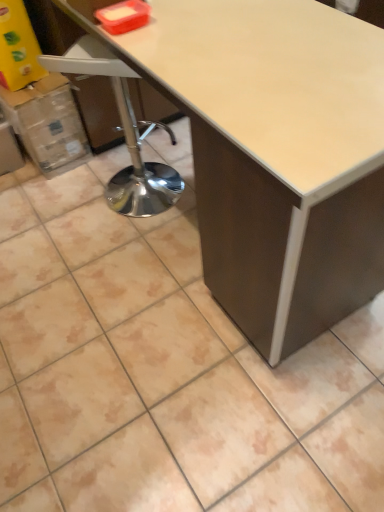
Question: Is matte white table at center at the left side of cardboard box at left?

Choices:
 (A) yes
 (B) no

Answer: (B)

Question: Is cardboard box at left inside matte white table at center?

Choices:
 (A) no
 (B) yes

Answer: (A)

Question: Is matte white table at center not inside cardboard box at left?

Choices:
 (A) yes
 (B) no

Answer: (A)

Question: From a real-world perspective, is matte white table at center below cardboard box at left?

Choices:
 (A) yes
 (B) no

Answer: (B)

Question: From a real-world perspective, is matte white table at center located higher than cardboard box at left?

Choices:
 (A) yes
 (B) no

Answer: (A)

Question: Is matte white table at center wider or thinner than white plastic swivel chair at left?

Choices:
 (A) wide
 (B) thin

Answer: (A)

Question: In terms of size, does matte white table at center appear bigger or smaller than white plastic swivel chair at left?

Choices:
 (A) small
 (B) big

Answer: (B)

Question: From the image's perspective, is matte white table at center positioned above or below white plastic swivel chair at left?

Choices:
 (A) above
 (B) below

Answer: (B)

Question: Visually, is matte white table at center positioned to the left or to the right of white plastic swivel chair at left?

Choices:
 (A) left
 (B) right

Answer: (B)

Question: Considering the positions of white plastic swivel chair at left and cardboard box at left in the image, is white plastic swivel chair at left bigger or smaller than cardboard box at left?

Choices:
 (A) small
 (B) big

Answer: (B)

Question: Is white plastic swivel chair at left inside the boundaries of cardboard box at left, or outside?

Choices:
 (A) inside
 (B) outside

Answer: (B)

Question: Visually, is white plastic swivel chair at left positioned to the left or to the right of cardboard box at left?

Choices:
 (A) left
 (B) right

Answer: (B)

Question: From the image's perspective, relative to cardboard box at left, is white plastic swivel chair at left above or below?

Choices:
 (A) above
 (B) below

Answer: (B)

Question: In terms of height, does cardboard box at left look taller or shorter compared to matte white table at center?

Choices:
 (A) short
 (B) tall

Answer: (A)

Question: In terms of width, does cardboard box at left look wider or thinner when compared to matte white table at center?

Choices:
 (A) wide
 (B) thin

Answer: (B)